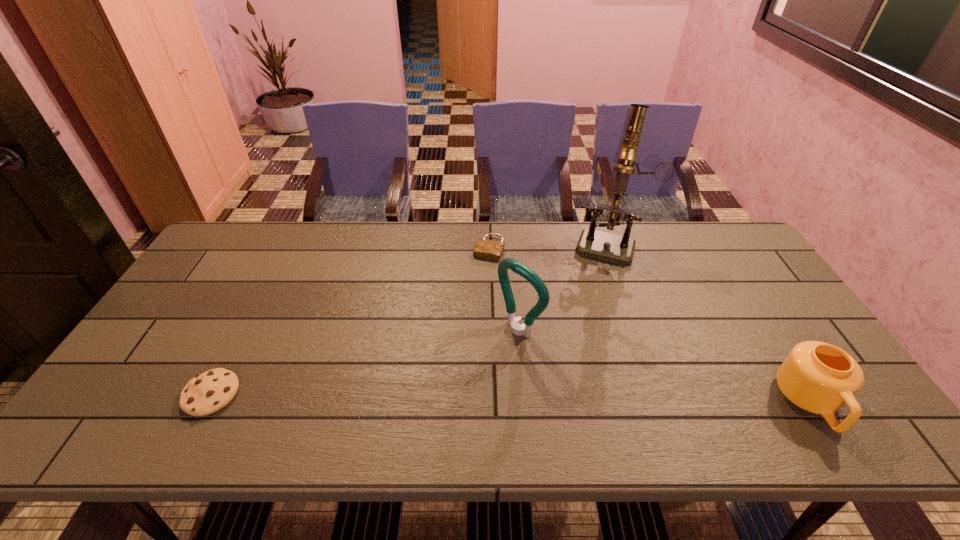
Where is `free region located 0.190m at the jaws of the third farthest object`? free region located 0.190m at the jaws of the third farthest object is located at coordinates (451, 384).

You are a GUI agent. You are given a task and a screenshot of the screen. Output one action in this format:
    pyautogui.click(x=<x>, y=<y>)
    Task: Click on the free space located at the jaws of the third farthest object
    
    Given the screenshot: What is the action you would take?
    [x=439, y=395]

What are the coordinates of `vacant space positioned 0.190m at the jaws of the third farthest object` in the screenshot? It's located at (451, 384).

Locate an element on the screen. This screenshot has height=540, width=960. free space located on the keyhole side of the padlock is located at coordinates (448, 348).

Find the location of a particular element. This screenshot has width=960, height=540. vacant region located on the keyhole side of the padlock is located at coordinates (452, 340).

This screenshot has width=960, height=540. Identify the location of vacant region located on the keyhole side of the padlock. (462, 316).

Find the location of a particular element. free location located at the eyepiece of the microscope is located at coordinates (588, 314).

At what (x,y) coordinates should I click in order to perform the action: click on free point located at the eyepiece of the microscope. Please return your answer as a coordinate pair (x, y). Image resolution: width=960 pixels, height=540 pixels. Looking at the image, I should click on (595, 291).

Locate an element on the screen. Image resolution: width=960 pixels, height=540 pixels. free spot located at the eyepiece of the microscope is located at coordinates (586, 326).

This screenshot has height=540, width=960. In order to click on padlock situated at the far edge in this screenshot , I will do `click(487, 249)`.